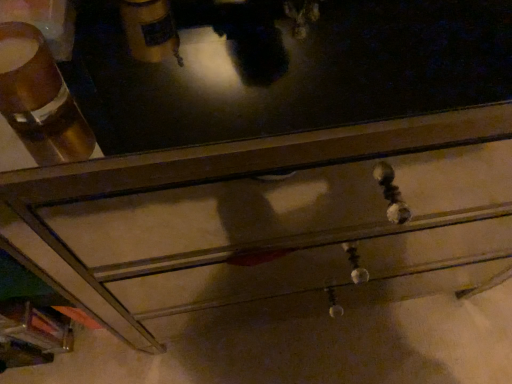
Question: Is metallic drawer at center outside matte brown cup at upper left?

Choices:
 (A) yes
 (B) no

Answer: (A)

Question: From the image's perspective, would you say metallic drawer at center is shown under matte brown cup at upper left?

Choices:
 (A) no
 (B) yes

Answer: (B)

Question: Is metallic drawer at center in front of matte brown cup at upper left?

Choices:
 (A) yes
 (B) no

Answer: (B)

Question: Can you confirm if metallic drawer at center is thinner than matte brown cup at upper left?

Choices:
 (A) yes
 (B) no

Answer: (B)

Question: Is metallic drawer at center at the right side of matte brown cup at upper left?

Choices:
 (A) yes
 (B) no

Answer: (A)

Question: From a real-world perspective, is metallic drawer at center on matte brown cup at upper left?

Choices:
 (A) no
 (B) yes

Answer: (A)

Question: Can you confirm if matte brown cup at upper left is thinner than metallic drawer at center?

Choices:
 (A) yes
 (B) no

Answer: (A)

Question: Is matte brown cup at upper left shorter than metallic drawer at center?

Choices:
 (A) yes
 (B) no

Answer: (A)

Question: From a real-world perspective, is matte brown cup at upper left over metallic drawer at center?

Choices:
 (A) yes
 (B) no

Answer: (A)

Question: From the image's perspective, is matte brown cup at upper left located beneath metallic drawer at center?

Choices:
 (A) no
 (B) yes

Answer: (A)

Question: Is matte brown cup at upper left outside of metallic drawer at center?

Choices:
 (A) yes
 (B) no

Answer: (A)

Question: From a real-world perspective, is matte brown cup at upper left positioned under metallic drawer at center based on gravity?

Choices:
 (A) no
 (B) yes

Answer: (A)

Question: In terms of height, does matte brown cup at upper left look taller or shorter compared to metallic drawer at center?

Choices:
 (A) short
 (B) tall

Answer: (A)